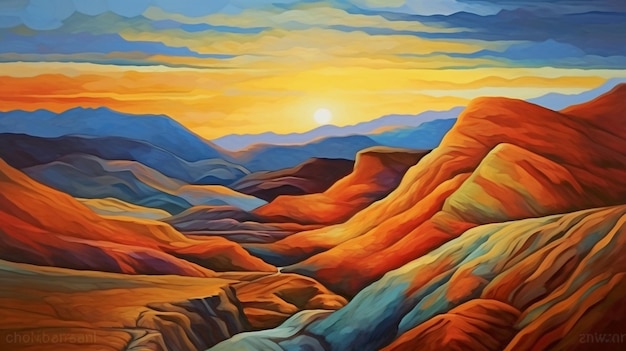
This screenshot has height=351, width=626. Find the location of `art work`. art work is located at coordinates (393, 204).